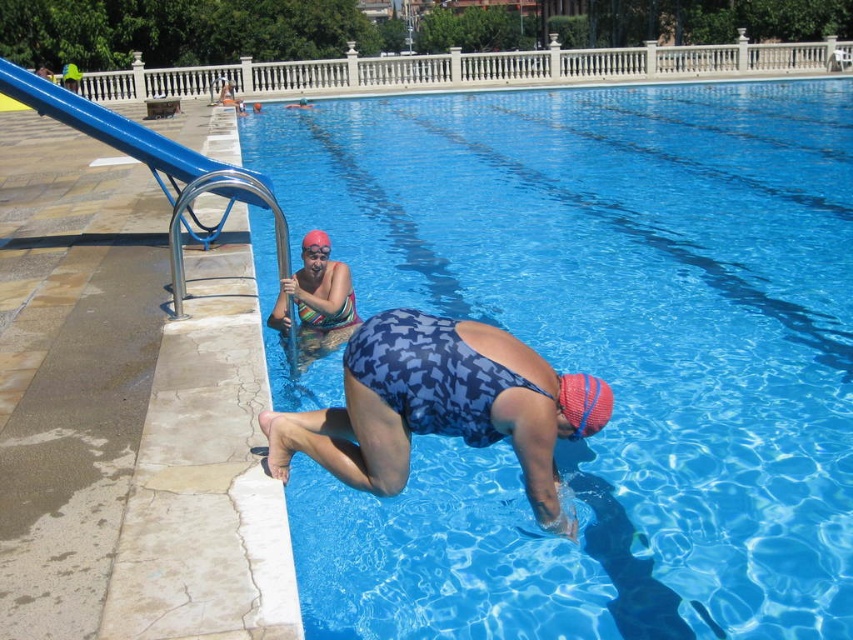
Based on the coordinates provided, where is the multicolored swimsuit at center located in the image?

The multicolored swimsuit at center is located at the coordinates point (316, 305).

You are a photographer at the pool and want to capture a photo of the blue printed swimsuit at center and the red mesh swim cap at lower center. To ensure both are in frame, which object should you position closer to the left side of your camera viewfinder?

The blue printed swimsuit at center is positioned on the left side of red mesh swim cap at lower center, so you should position the blue printed swimsuit at center closer to the left side of your camera viewfinder to include both in the frame.

Based on the photo, you are a lifeguard observing the pool area. You notice two swimmers in the water. One is wearing a multicolored swimsuit at center and the other has a red mesh swim cap at lower center. Which swimmer is closer to the surface of the water?

The multicolored swimsuit at center is located above the red mesh swim cap at lower center, meaning the swimmer in the multicolored swimsuit at center is closer to the surface of the water.